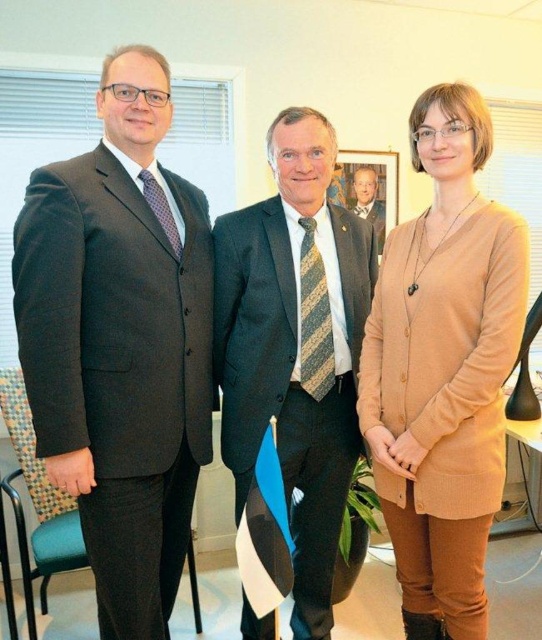
You are standing in an office and need to place a new plant pot that is 0.3 meters wide. The plant pot must be placed at point [367,188]. However, there is already an object there. What object is blocking this spot?

The wooden picture frame at center is located at point [367,188], so it is blocking the spot where you want to place the plant pot.

You are an assistant who needs to hand a document to the person wearing the dark gray suit at center and the light brown wood tie at center. Since both are at center, which one should you approach first based on their positions?

You should approach the dark gray suit at center first because it is closer to the viewer than the light brown wood tie at center.

You are organizing a charity event and need to ensure that all donated items fit into a storage box. You have a dark gray suit at center and a light brown wood tie at center. Which item requires more space in the box?

The dark gray suit at center requires more space in the box because it is larger in size than the light brown wood tie at center.